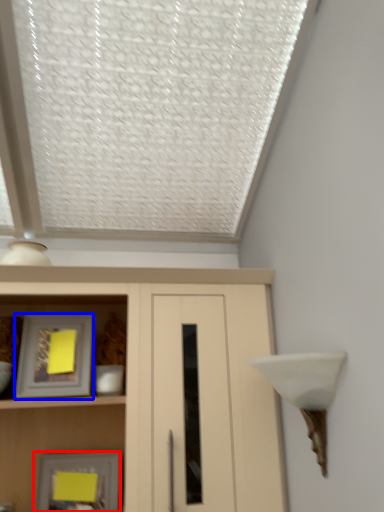
Question: Which object appears farthest to the camera in this image, picture frame (highlighted by a red box) or picture frame (highlighted by a blue box)?

Choices:
 (A) picture frame
 (B) picture frame

Answer: (A)